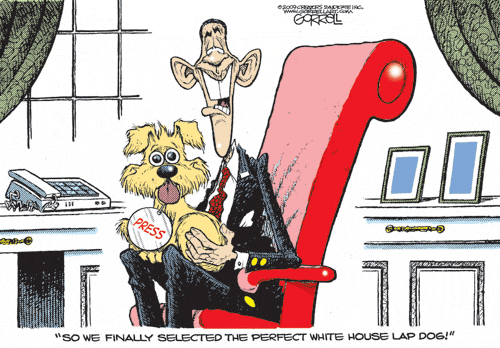
Locate an element on the screen. This screenshot has height=348, width=500. red chair is located at coordinates (346, 66), (326, 147), (301, 233), (300, 304), (243, 322).